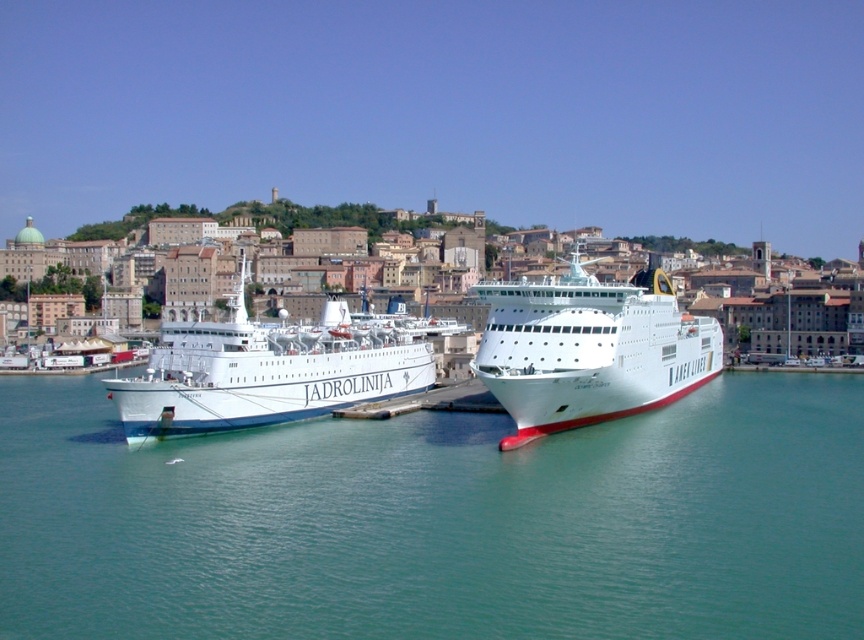
Which is above, white glossy ship at center or white glossy ship at left?

white glossy ship at center is above.

Does white glossy ship at center have a greater height compared to white glossy ship at left?

Yes, white glossy ship at center is taller than white glossy ship at left.

Where is `white glossy ship at center`? This screenshot has height=640, width=864. white glossy ship at center is located at coordinates (589, 349).

Where is `white glossy ship at center`? The height and width of the screenshot is (640, 864). white glossy ship at center is located at coordinates (589, 349).

What do you see at coordinates (439, 522) in the screenshot? I see `clear blue water at center` at bounding box center [439, 522].

Locate an element on the screen. The height and width of the screenshot is (640, 864). clear blue water at center is located at coordinates (439, 522).

Which is behind, point (642, 472) or point (523, 353)?

Point (523, 353)

What are the coordinates of `clear blue water at center` in the screenshot? It's located at (439, 522).

Does clear blue water at center appear on the right side of white glossy ship at left?

Indeed, clear blue water at center is positioned on the right side of white glossy ship at left.

Does clear blue water at center have a greater height compared to white glossy ship at left?

Incorrect, clear blue water at center's height is not larger of white glossy ship at left's.

What do you see at coordinates (439, 522) in the screenshot? I see `clear blue water at center` at bounding box center [439, 522].

At what (x,y) coordinates should I click in order to perform the action: click on clear blue water at center. Please return your answer as a coordinate pair (x, y). The height and width of the screenshot is (640, 864). Looking at the image, I should click on (439, 522).